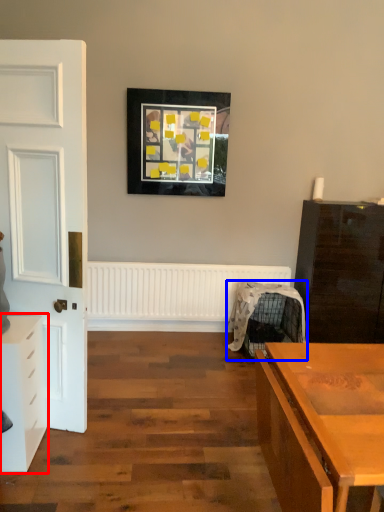
Question: Which object is further to the camera taking this photo, chest of drawers (highlighted by a red box) or swivel chair (highlighted by a blue box)?

Choices:
 (A) chest of drawers
 (B) swivel chair

Answer: (B)